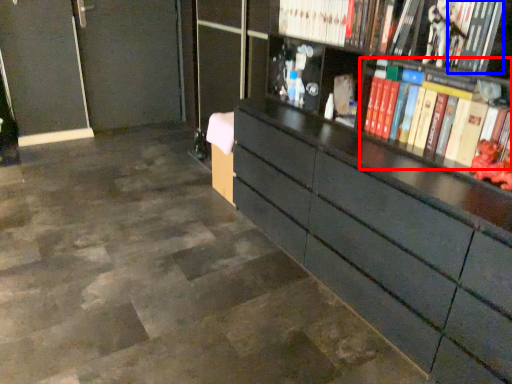
Question: Which of the following is the farthest to the observer, book (highlighted by a red box) or book (highlighted by a blue box)?

Choices:
 (A) book
 (B) book

Answer: (B)